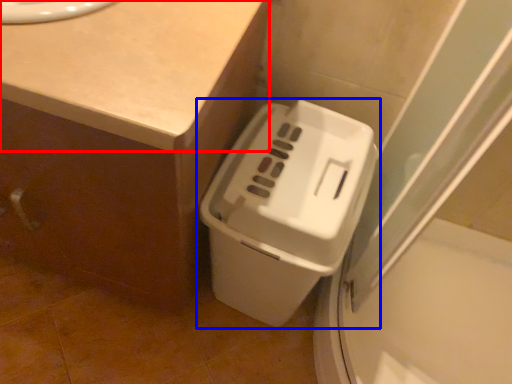
Question: Which object appears farthest to the camera in this image, counter top (highlighted by a red box) or waste container (highlighted by a blue box)?

Choices:
 (A) counter top
 (B) waste container

Answer: (B)